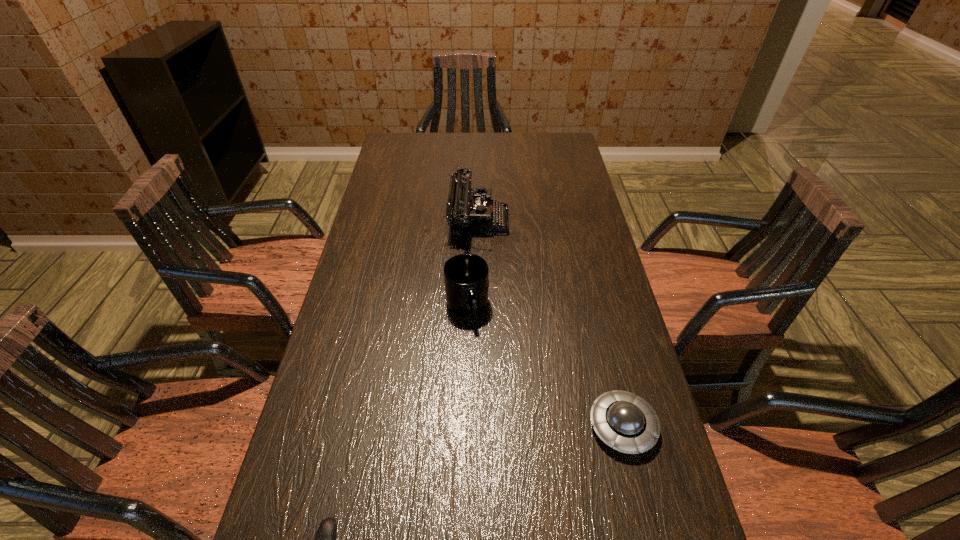
Identify the location of free space that satisfies the following two spatial constraints: 1. on the back side of the saucer; 2. on the keyboard of the typewriter. (573, 220).

Where is `free space that satisfies the following two spatial constraints: 1. on the keyboard of the farthest object; 2. with the handle on the side of the third nearest object`? Image resolution: width=960 pixels, height=540 pixels. free space that satisfies the following two spatial constraints: 1. on the keyboard of the farthest object; 2. with the handle on the side of the third nearest object is located at coordinates (x=477, y=306).

You are a GUI agent. You are given a task and a screenshot of the screen. Output one action in this format:
    pyautogui.click(x=<x>, y=<y>)
    Task: Click on the free spot that satisfies the following two spatial constraints: 1. on the back side of the saucer; 2. on the keyboard of the typewriter
    
    Given the screenshot: What is the action you would take?
    pyautogui.click(x=573, y=220)